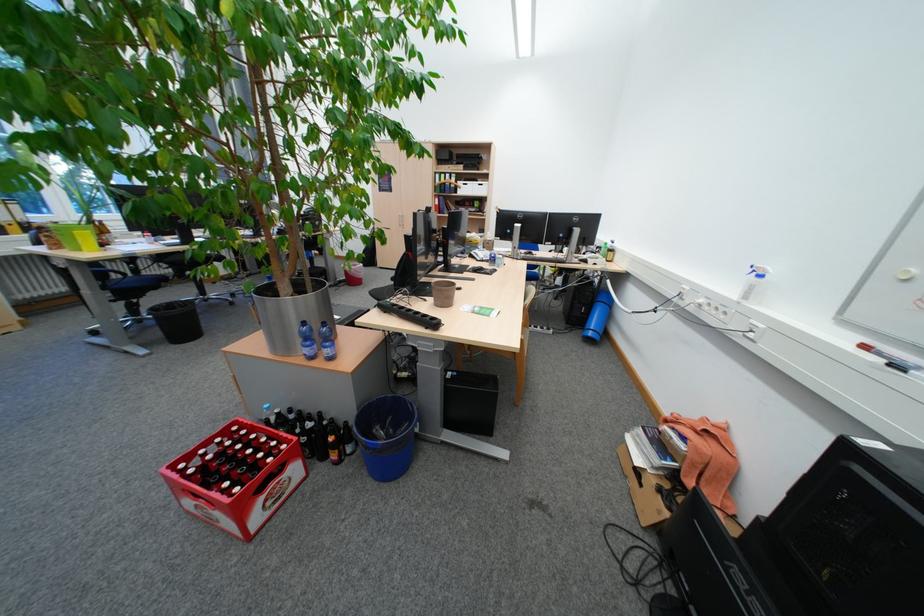
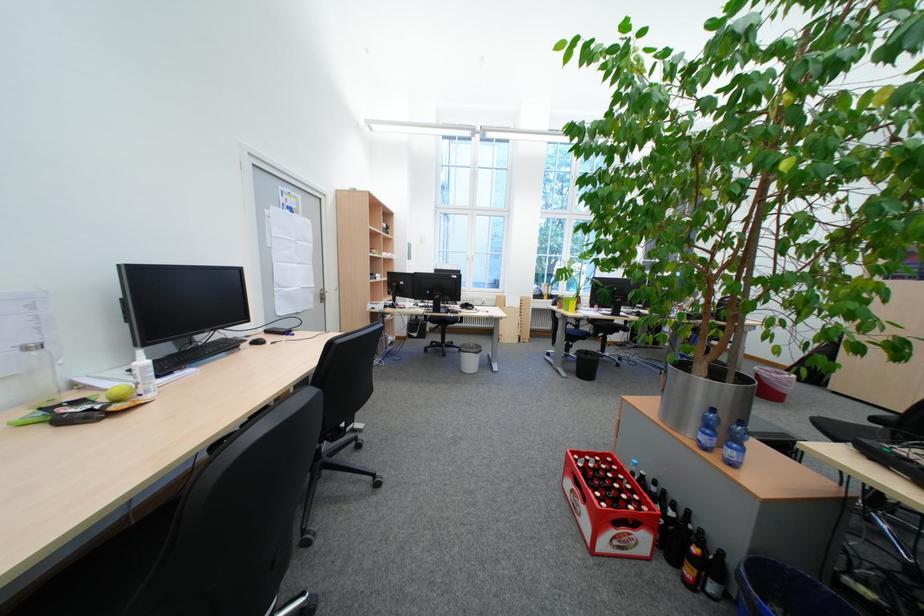
Question: I am providing you with two images of the same scene from different viewpoints. Please identify which objects are invisible in image2.

Choices:
 (A) blue water bottle
 (B) blue plastic bucket
 (C) red beverage crate
 (D) none of these

Answer: (D)